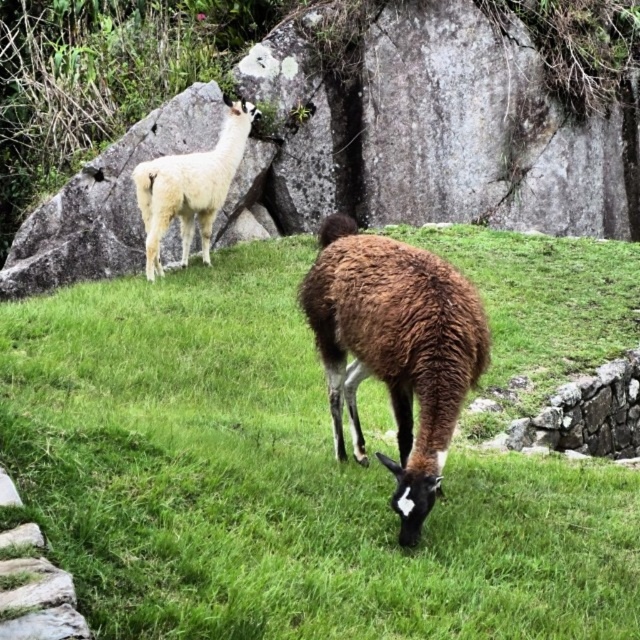
Question: Is brown woolly alpaca at center to the right of white woolly alpaca at upper left from the viewer's perspective?

Choices:
 (A) no
 (B) yes

Answer: (B)

Question: Which of the following is the farthest from the observer?

Choices:
 (A) white woolly alpaca at upper left
 (B) brown woolen llama at center

Answer: (A)

Question: Can you confirm if brown woolly alpaca at center is positioned below white woolly alpaca at upper left?

Choices:
 (A) no
 (B) yes

Answer: (B)

Question: Is brown woolen llama at center bigger than white woolly alpaca at upper left?

Choices:
 (A) no
 (B) yes

Answer: (A)

Question: Considering the real-world distances, which object is closest to the brown woolly alpaca at center?

Choices:
 (A) white woolly alpaca at upper left
 (B) brown woolen llama at center

Answer: (B)

Question: Which object is the farthest from the brown woolly alpaca at center?

Choices:
 (A) white woolly alpaca at upper left
 (B) brown woolen llama at center

Answer: (A)